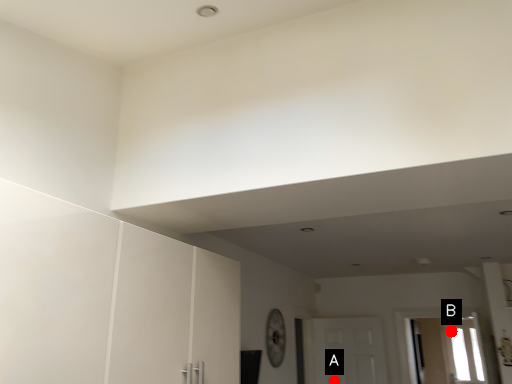
Question: Two points are circled on the image, labeled by A and B beside each circle. Which point appears farthest from the camera in this image?

Choices:
 (A) A is further
 (B) B is further

Answer: (A)